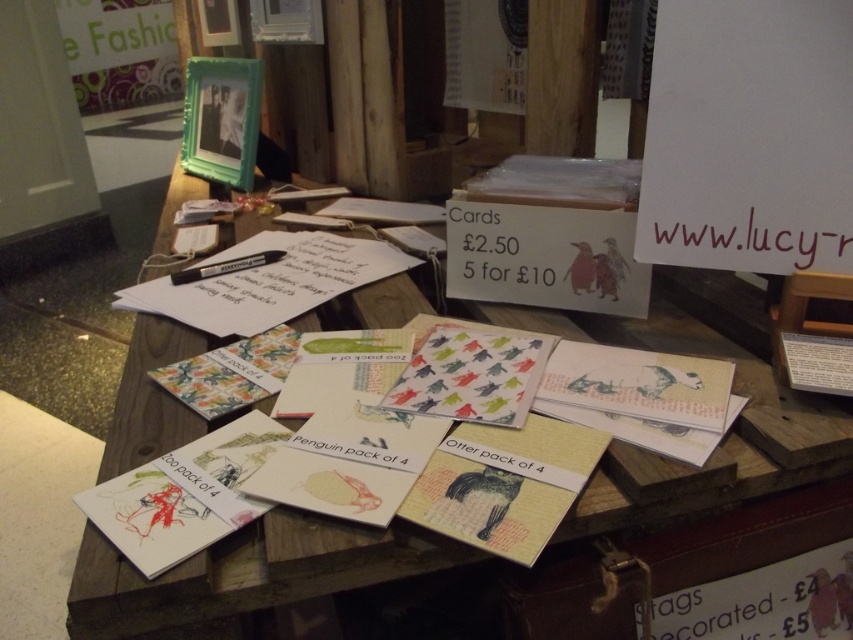
You are organizing a craft fair booth and need to arrange items on the table. You have the wooden cards at center and the white paper at upper right. Based on their sizes, which item should you place closer to the edge to ensure stability?

The wooden cards at center are wider than the white paper at upper right, so placing the white paper at upper right closer to the edge would be more stable since it is narrower.

You are at a craft fair and want to buy a greeting card. You see a white paper at upper right and a matte paper card at center. Which one is located more to the right?

The white paper at upper right is positioned on the right side of the matte paper card at center, so it is more to the right.

You are a customer at the craft fair looking at the table. Can you tell me the exact coordinates of the white paper at upper right on the table?

The white paper at upper right is located at coordinates point (749, 136).